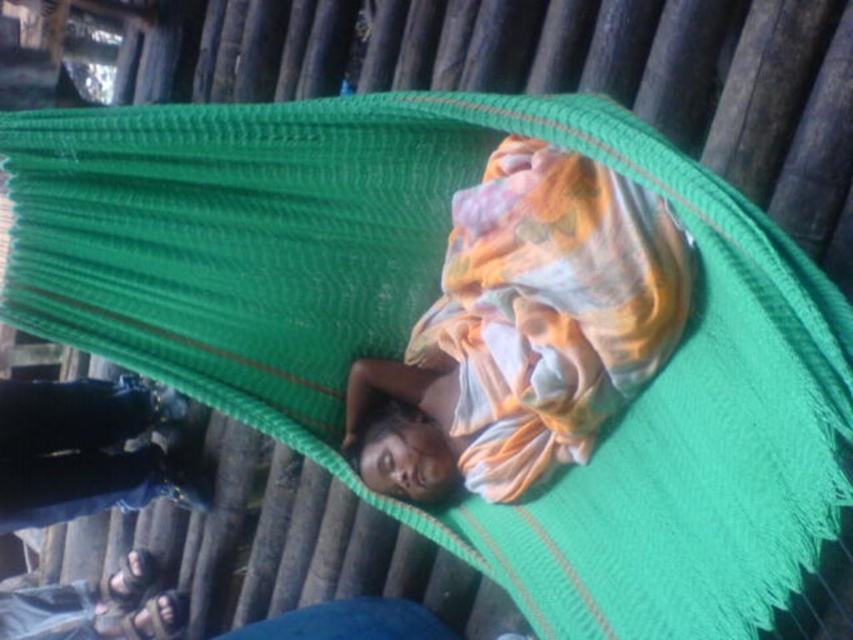
Who is more distant from viewer, (514, 460) or (67, 493)?

Positioned behind is point (67, 493).

Between multicolored fabric at center and denim pants at lower left, which one is positioned higher?

multicolored fabric at center

At what (x,y) coordinates should I click in order to perform the action: click on multicolored fabric at center. Please return your answer as a coordinate pair (x, y). The image size is (853, 640). Looking at the image, I should click on (525, 330).

You are a GUI agent. You are given a task and a screenshot of the screen. Output one action in this format:
    pyautogui.click(x=<x>, y=<y>)
    Task: Click on the multicolored fabric at center
    The image size is (853, 640).
    Given the screenshot: What is the action you would take?
    pyautogui.click(x=525, y=330)